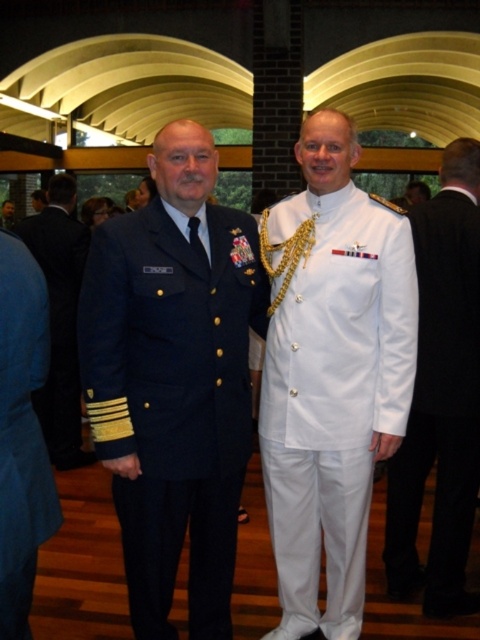
Question: Does white glossy uniform at right have a larger size compared to blue fabric jacket at left?

Choices:
 (A) yes
 (B) no

Answer: (A)

Question: Which is farther from the navy blue fabric uniform at left?

Choices:
 (A) dark blue uniform at left
 (B) blue fabric jacket at left
 (C) white glossy uniform at right

Answer: (A)

Question: Is navy blue fabric uniform at left closer to the viewer compared to white glossy uniform at center?

Choices:
 (A) no
 (B) yes

Answer: (B)

Question: Which point is farther to the camera?

Choices:
 (A) blue fabric jacket at left
 (B) navy blue fabric uniform at left
 (C) white glossy uniform at center

Answer: (C)

Question: Can you confirm if navy blue fabric uniform at left is bigger than white glossy uniform at right?

Choices:
 (A) no
 (B) yes

Answer: (B)

Question: Which point is farther to the camera?

Choices:
 (A) (405, 298)
 (B) (394, 541)

Answer: (B)